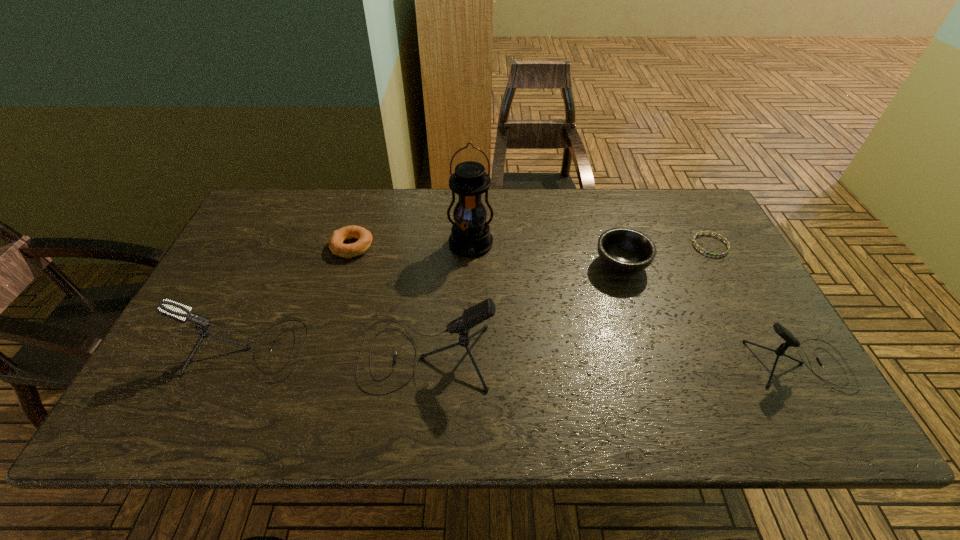
Where is `vacant region located on the stand of the second tallest microphone`? vacant region located on the stand of the second tallest microphone is located at coordinates (442, 350).

This screenshot has height=540, width=960. In order to click on vacant space located on the stand of the second microphone from left to right in this screenshot , I will do `click(283, 355)`.

At what (x,y) coordinates should I click in order to perform the action: click on vacant space located on the stand of the second microphone from left to right. Please return your answer as a coordinate pair (x, y). The height and width of the screenshot is (540, 960). Looking at the image, I should click on (279, 355).

Image resolution: width=960 pixels, height=540 pixels. Find the location of `free region located 0.230m on the stand of the second microphone from left to right`. free region located 0.230m on the stand of the second microphone from left to right is located at coordinates (262, 355).

Pinpoint the vacant space located above the lantern, indicating its light source. Please provide its 2D coordinates. Your answer should be formatted as a tuple, i.e. [(x, y)], where the tuple contains the x and y coordinates of a point satisfying the conditions above.

[(468, 374)]

Where is `vacant space located 0.150m on the back of the bagel`? Image resolution: width=960 pixels, height=540 pixels. vacant space located 0.150m on the back of the bagel is located at coordinates (365, 204).

The width and height of the screenshot is (960, 540). In order to click on free space located 0.280m on the front of the third object from right to left in this screenshot , I will do `click(657, 375)`.

Identify the location of blank space located on the surface of the bracelet showing star-shaped elements. Image resolution: width=960 pixels, height=540 pixels. (737, 296).

Locate an element on the screen. lantern that is positioned at the far edge is located at coordinates (470, 236).

Image resolution: width=960 pixels, height=540 pixels. I want to click on bagel positioned at the far edge, so click(364, 237).